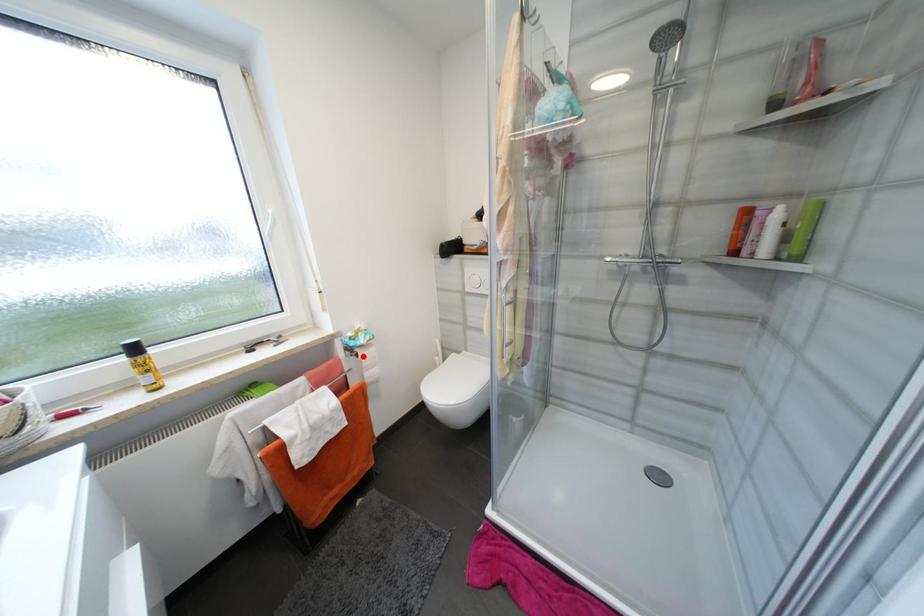
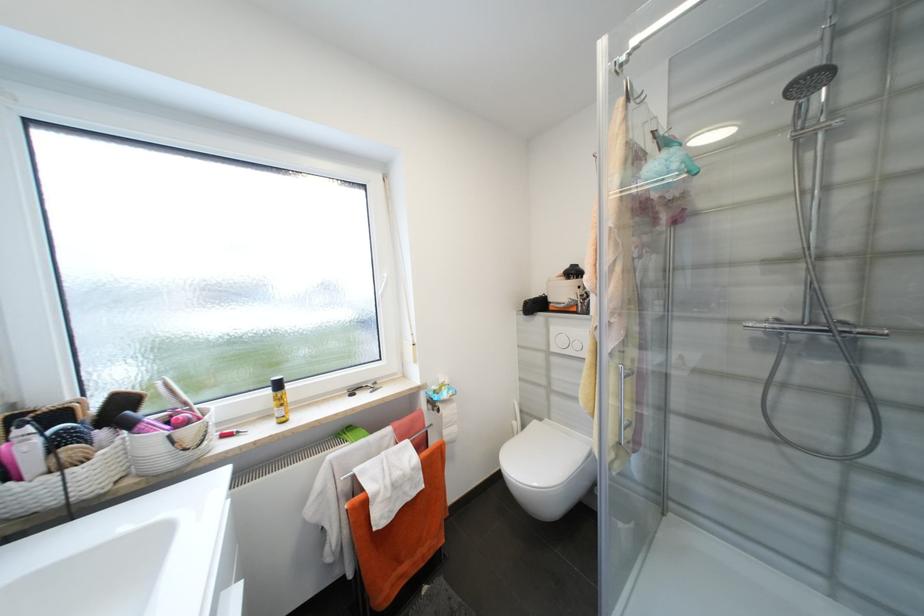
Question: I am providing you with two images of the same scene from different viewpoints. In image1, a red point is highlighted. Considering the same 3D point in image2, which of the following is correct?

Choices:
 (A) It is closer
 (B) It is farther

Answer: (B)